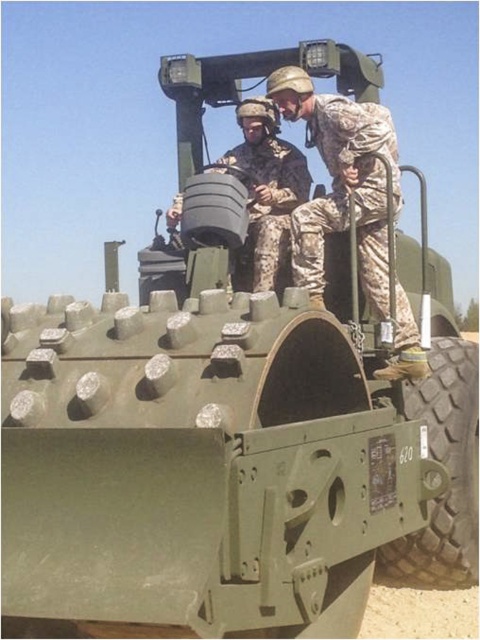
You are standing at the point labeled as point (443,496). The APC is 3.59 meters away from you. If you want to move closer to the APC, which direction should you walk?

Since the point (443,496) is 3.59 meters away from the viewer, you should walk towards the APC to get closer.

You are a military observer analyzing the APC. From your vantage point, which object is positioned to the right of the other between the rubber tread tire at lower right and the camouflage fabric helmet at upper center?

The rubber tread tire at lower right is positioned to the right of the camouflage fabric helmet at upper center.

You are a military supply officer inspecting the equipment of soldiers on a military vehicle. You notice two items made of camouflage fabric. The first is the camouflage fabric uniform at center, and the second is the camouflage fabric helmet at upper center. Which item has a greater width?

The camouflage fabric uniform at center has a greater width than the camouflage fabric helmet at upper center.